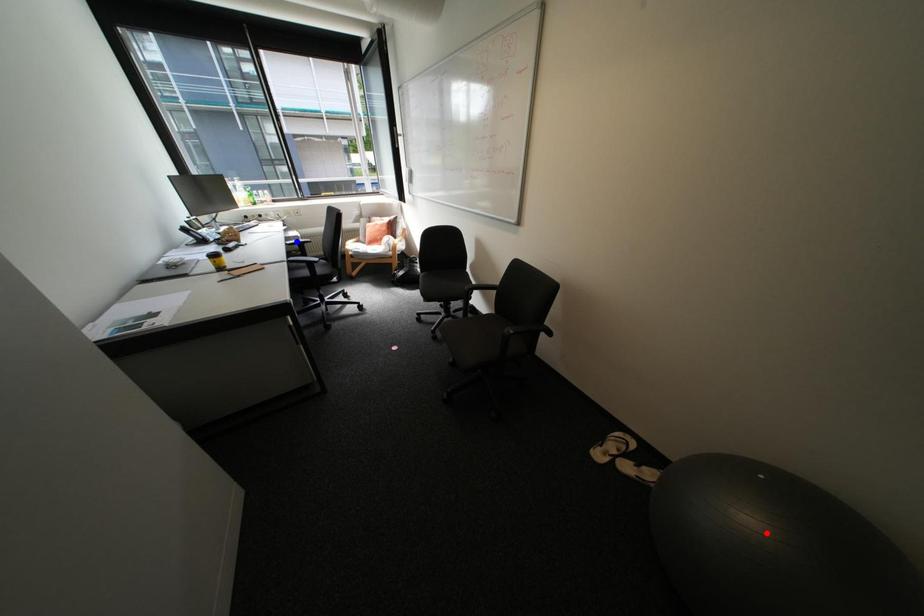
Question: In the image, two points are highlighted. Which point is nearer to the camera? Reply with the corresponding letter.

Choices:
 (A) blue point
 (B) red point

Answer: (B)